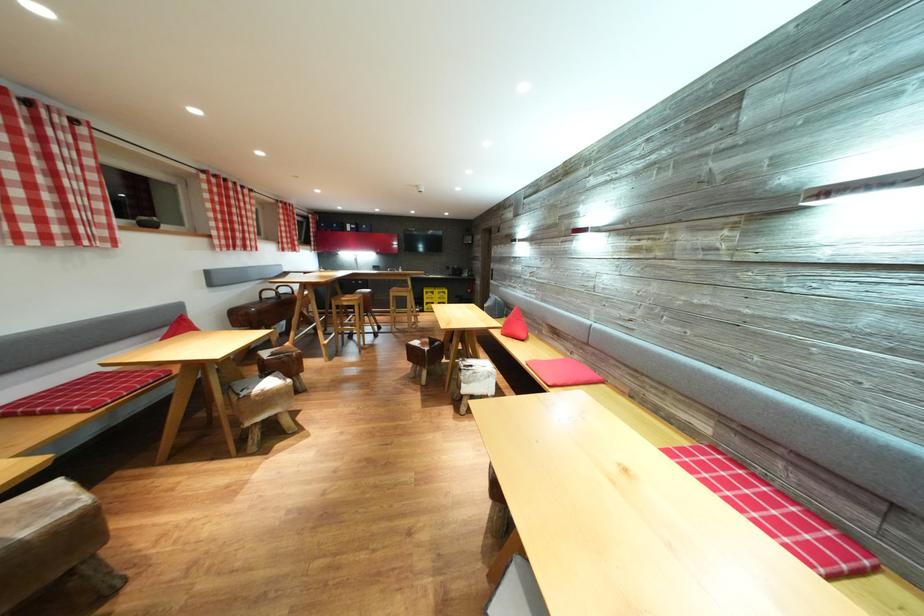
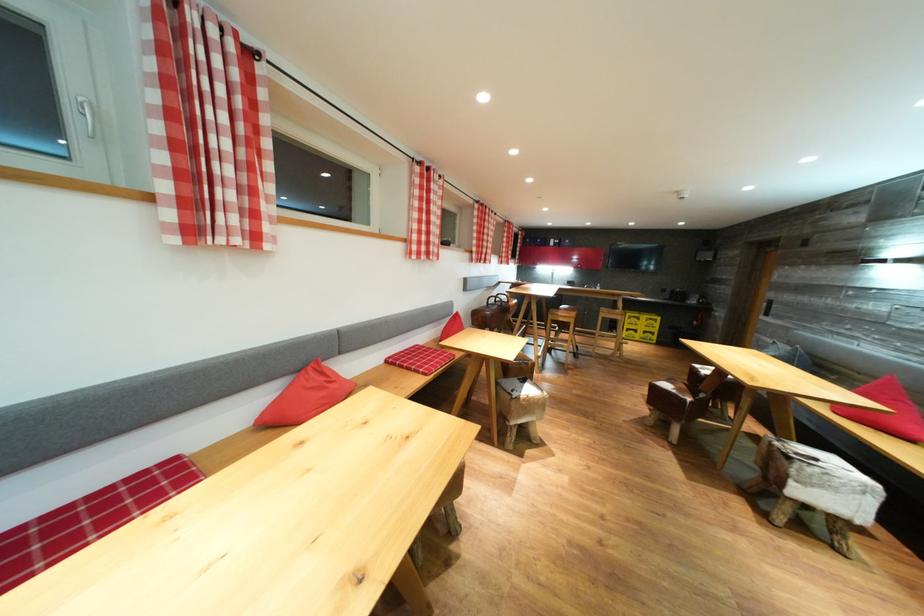
Locate, in the second image, the point that corresponds to pixel 276 389 in the first image.

(536, 395)